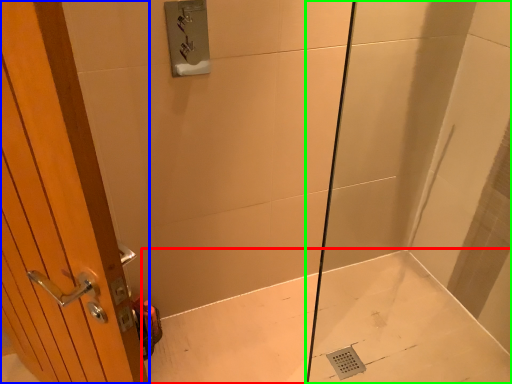
Question: Which object is positioned closest to bath (highlighted by a red box)? Select from door (highlighted by a blue box) and shower door (highlighted by a green box).

Choices:
 (A) door
 (B) shower door

Answer: (B)